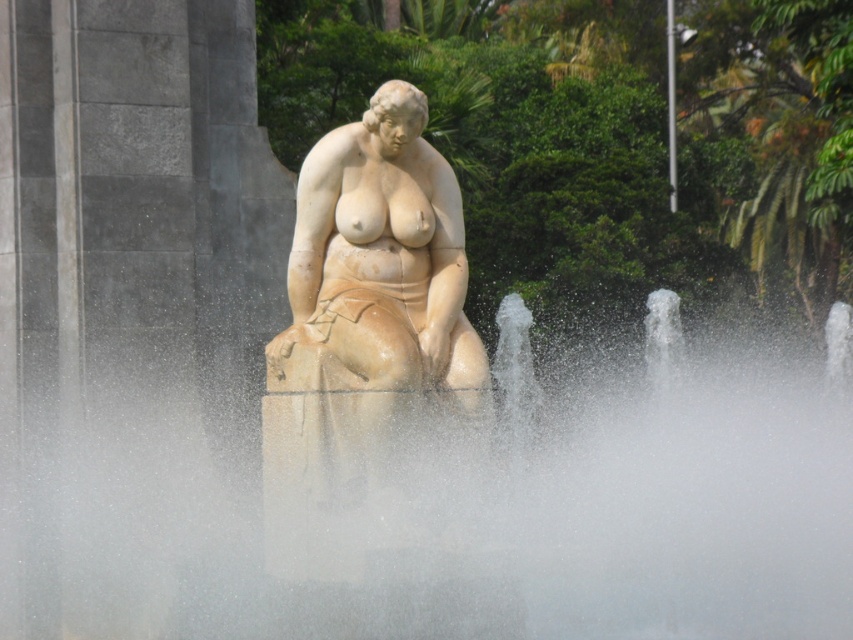
You are standing in front of the fountain and want to take a photo of the white marble statue at center without the white frothy water at center appearing in the foreground. Is this possible given their positions?

The white frothy water at center is closer to the viewer than the white marble statue at center, so it will block the statue in the foreground. To avoid the water in the photo, you need to adjust your angle or move closer to eliminate the water from the frame.